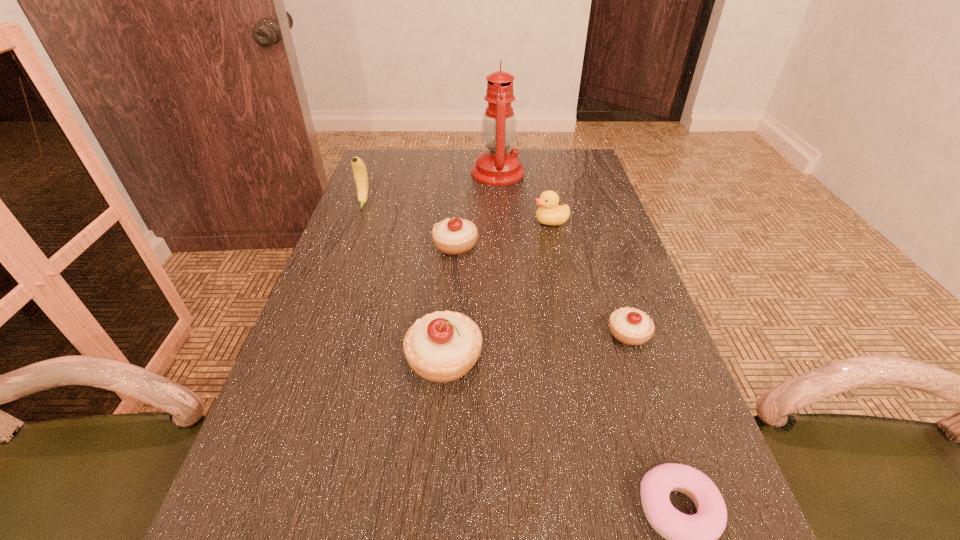
Locate which beige pastry is the second closest to the fourth nearest object. Please provide its 2D coordinates. Your answer should be formatted as a tuple, i.e. [(x, y)], where the tuple contains the x and y coordinates of a point satisfying the conditions above.

[(630, 326)]

This screenshot has height=540, width=960. I want to click on blank space that satisfies the following two spatial constraints: 1. on the face of the third tallest pastry; 2. on the right side of the fifth nearest object, so click(x=575, y=333).

At what (x,y) coordinates should I click in order to perform the action: click on free space that satisfies the following two spatial constraints: 1. from the stem of the biggest beige pastry; 2. on the left side of the banana. Please return your answer as a coordinate pair (x, y). Image resolution: width=960 pixels, height=540 pixels. Looking at the image, I should click on (305, 359).

At what (x,y) coordinates should I click in order to perform the action: click on free region that satisfies the following two spatial constraints: 1. from the stem of the third tallest object; 2. on the left side of the banana. Please return your answer as a coordinate pair (x, y). The image size is (960, 540). Looking at the image, I should click on (305, 359).

In order to click on vacant space that satisfies the following two spatial constraints: 1. from the stem of the banana; 2. on the right side of the biggest beige pastry in this screenshot , I will do 305,359.